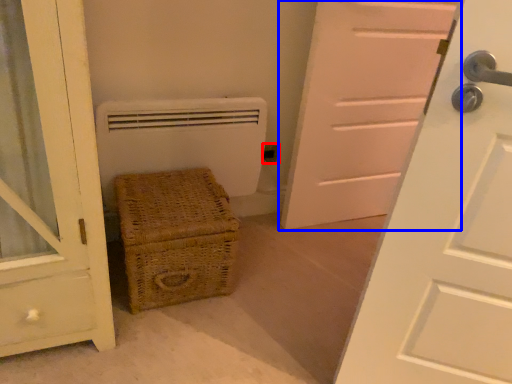
Question: Which object is closer to the camera taking this photo, electric outlet (highlighted by a red box) or door (highlighted by a blue box)?

Choices:
 (A) electric outlet
 (B) door

Answer: (B)